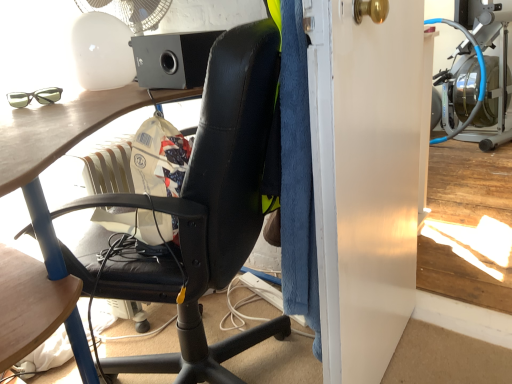
Question: Considering the relative sizes of black leather chair at center and black matte speaker at upper center in the image provided, is black leather chair at center wider than black matte speaker at upper center?

Choices:
 (A) no
 (B) yes

Answer: (B)

Question: Is black leather chair at center to the left of black matte speaker at upper center from the viewer's perspective?

Choices:
 (A) yes
 (B) no

Answer: (B)

Question: From a real-world perspective, does black leather chair at center sit lower than black matte speaker at upper center?

Choices:
 (A) yes
 (B) no

Answer: (A)

Question: Is black leather chair at center next to black matte speaker at upper center?

Choices:
 (A) no
 (B) yes

Answer: (A)

Question: From the image's perspective, does black leather chair at center appear lower than black matte speaker at upper center?

Choices:
 (A) yes
 (B) no

Answer: (A)

Question: Can you confirm if black leather chair at center is smaller than black matte speaker at upper center?

Choices:
 (A) yes
 (B) no

Answer: (B)

Question: Is matte black glasses at upper left completely or partially outside of black leather chair at center?

Choices:
 (A) no
 (B) yes

Answer: (B)

Question: Does matte black glasses at upper left appear on the right side of black leather chair at center?

Choices:
 (A) no
 (B) yes

Answer: (A)

Question: Is matte black glasses at upper left oriented away from black leather chair at center?

Choices:
 (A) yes
 (B) no

Answer: (B)

Question: Is black leather chair at center surrounded by matte black glasses at upper left?

Choices:
 (A) yes
 (B) no

Answer: (B)

Question: Can you confirm if matte black glasses at upper left is taller than black leather chair at center?

Choices:
 (A) no
 (B) yes

Answer: (A)

Question: From a real-world perspective, is matte black glasses at upper left beneath black leather chair at center?

Choices:
 (A) yes
 (B) no

Answer: (B)

Question: From a real-world perspective, is white glossy screen door at right on black matte speaker at upper center?

Choices:
 (A) yes
 (B) no

Answer: (B)